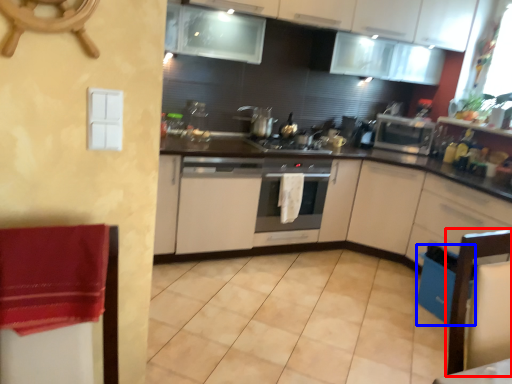
Question: Among these objects, which one is farthest to the camera, chair (highlighted by a red box) or dish washer (highlighted by a blue box)?

Choices:
 (A) chair
 (B) dish washer

Answer: (B)